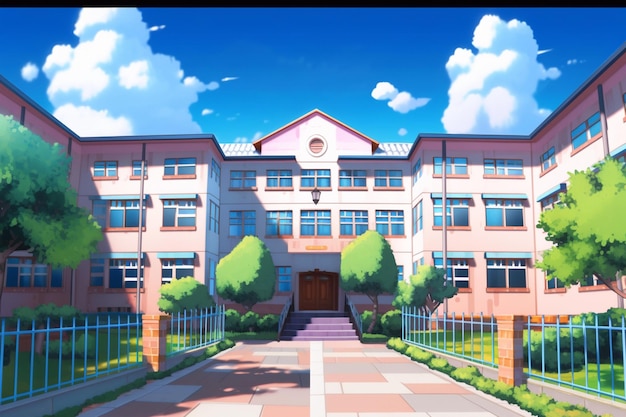
This screenshot has height=417, width=626. I want to click on windows, so click(x=321, y=228), click(x=355, y=218), click(x=238, y=224), click(x=177, y=216).